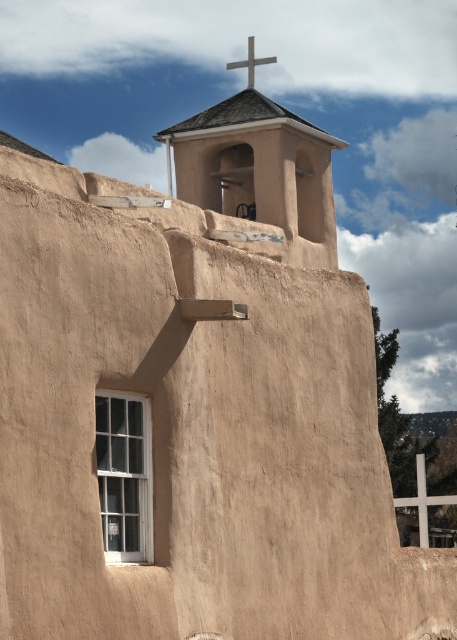
You are an architect inspecting the building. You notice the light brown stucco bell tower at upper center and the silver metallic cross at upper center. Which structure is taller?

The light brown stucco bell tower at upper center is much taller than the silver metallic cross at upper center.

You are an architect examining the traditional adobe building. You notice the light brown stucco bell tower at upper center and the silver metallic cross at upper center. Which object is positioned higher on the building?

The silver metallic cross at upper center is positioned higher because it is above the light brown stucco bell tower at upper center.

You are standing in front of the traditional adobe building and notice two objects at the upper center of the wall. Which one is positioned to the left between the light brown stucco bell tower at upper center and the silver metallic cross at upper center?

The light brown stucco bell tower at upper center is positioned to the left of the silver metallic cross at upper center.